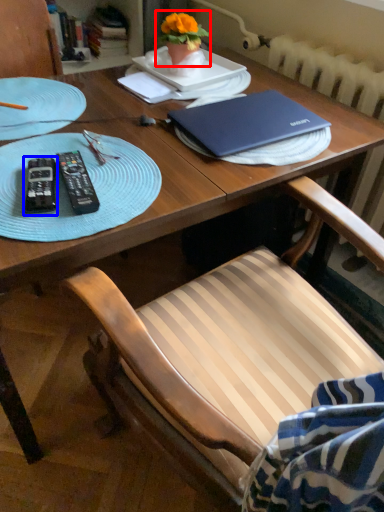
Question: Which object appears closest to the camera in this image, houseplant (highlighted by a red box) or remote control (highlighted by a blue box)?

Choices:
 (A) houseplant
 (B) remote control

Answer: (B)